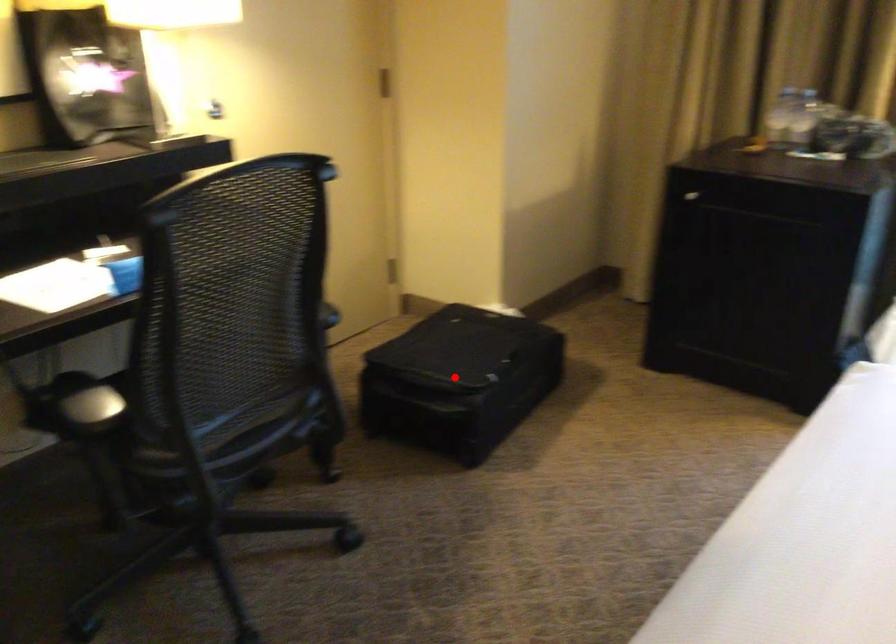
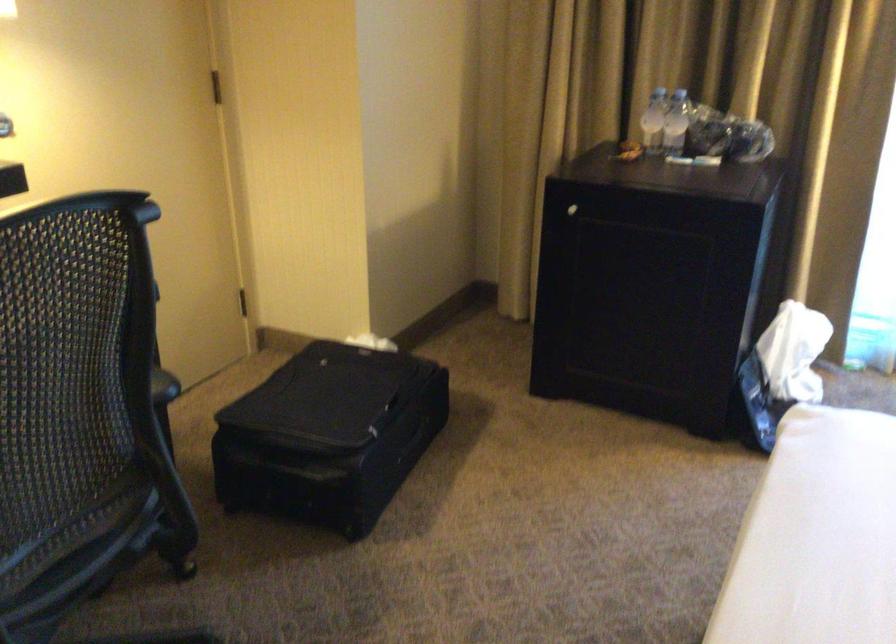
Locate, in the second image, the point that corresponds to the highlighted location in the first image.

(329, 436)